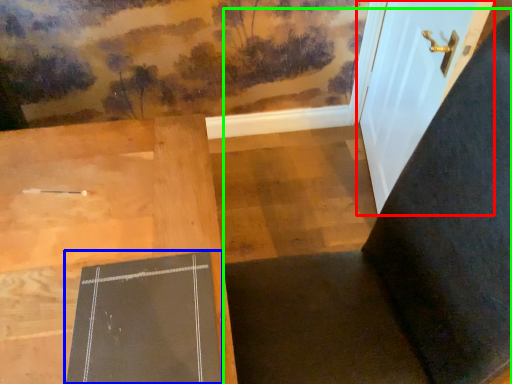
Question: Considering the real-world distances, which object is closest to door (highlighted by a red box)? bulletin board (highlighted by a blue box) or chair (highlighted by a green box).

Choices:
 (A) bulletin board
 (B) chair

Answer: (B)